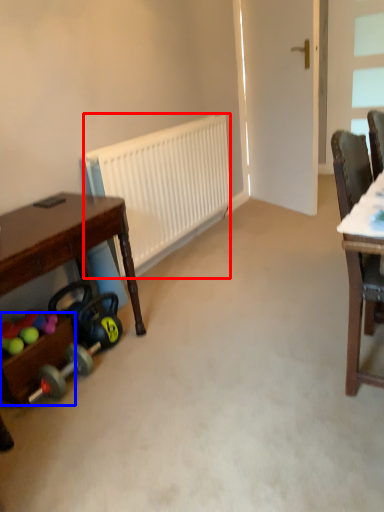
Question: Which object appears closest to the camera in this image, radiator (highlighted by a red box) or drawer (highlighted by a blue box)?

Choices:
 (A) radiator
 (B) drawer

Answer: (B)